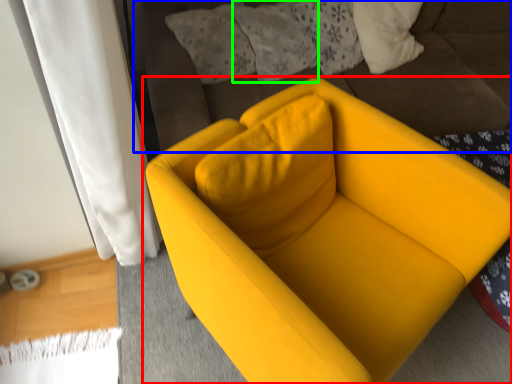
Question: Estimate the real-world distances between objects in this image. Which object is closer to chair (highlighted by a red box), bedding (highlighted by a blue box) or pillow (highlighted by a green box)?

Choices:
 (A) bedding
 (B) pillow

Answer: (A)